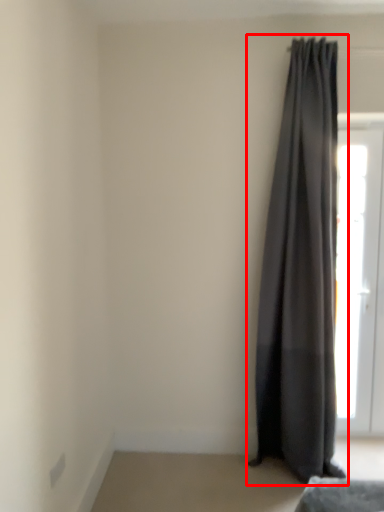
Question: Considering the relative positions of curtain (annotated by the red box) and door in the image provided, where is curtain (annotated by the red box) located with respect to the staircase?

Choices:
 (A) right
 (B) left

Answer: (B)